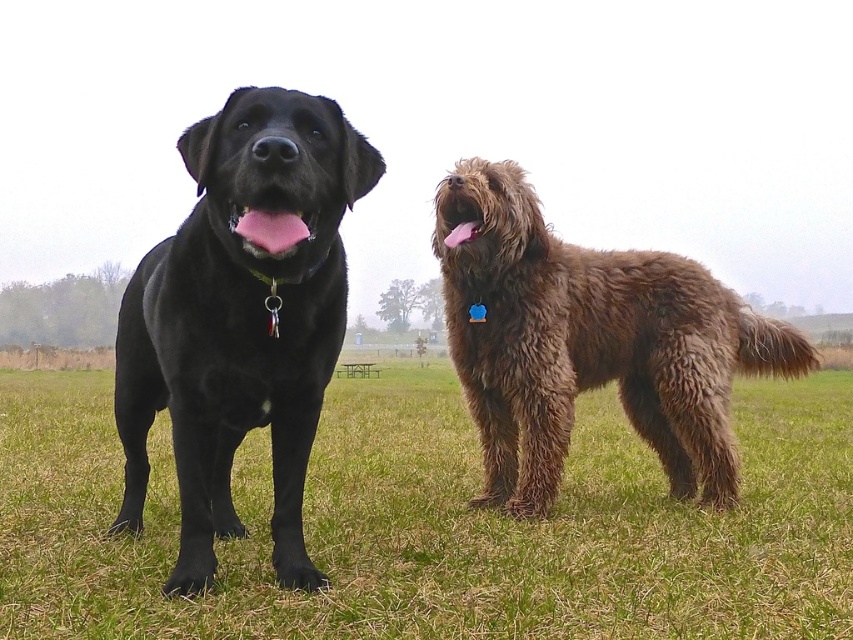
In the scene shown: You are standing at point point (772, 605) and want to take a photo of the two dogs with your camera. The camera is 2.86 meters away from you. Will the dogs be in focus if the camera has a maximum focus distance of 3 meters?

The camera is 2.86 meters away from point (772, 605), which is within the camera maximum focus distance of 3 meters. Therefore, the dogs will be in focus.

You are a dog owner trying to decide which dog to adopt. Both dogs are in the same image. The matte black dog at left and the fuzzy brown dog at right. Which dog is wider?

The fuzzy brown dog at right is wider than the matte black dog at left.

You are a gardener who wants to plant a new flower bed in the green grass at lower center. Considering the height of the fuzzy brown dog at right, will the grass grow tall enough to hide the flowers from the dog?

The green grass at lower center has a lesser height compared to the fuzzy brown dog at right, so the grass will not grow tall enough to hide the flowers from the dog.